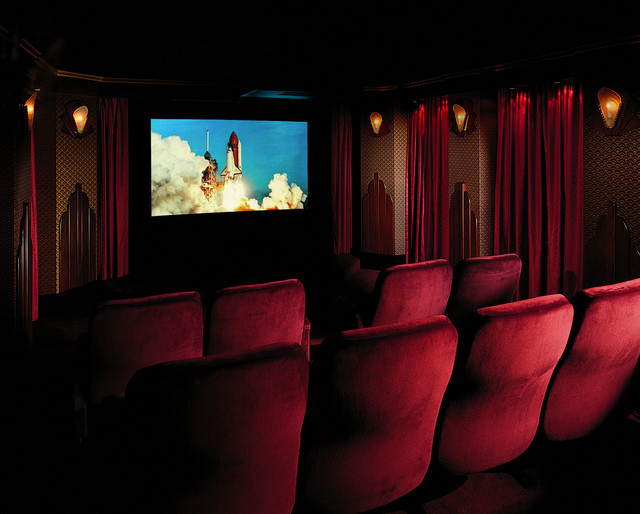
You are a GUI agent. You are given a task and a screenshot of the screen. Output one action in this format:
    pyautogui.click(x=<x>, y=<y>)
    Task: Click on the light
    
    Given the screenshot: What is the action you would take?
    pyautogui.click(x=34, y=121), pyautogui.click(x=83, y=121), pyautogui.click(x=379, y=127), pyautogui.click(x=470, y=123), pyautogui.click(x=620, y=108)